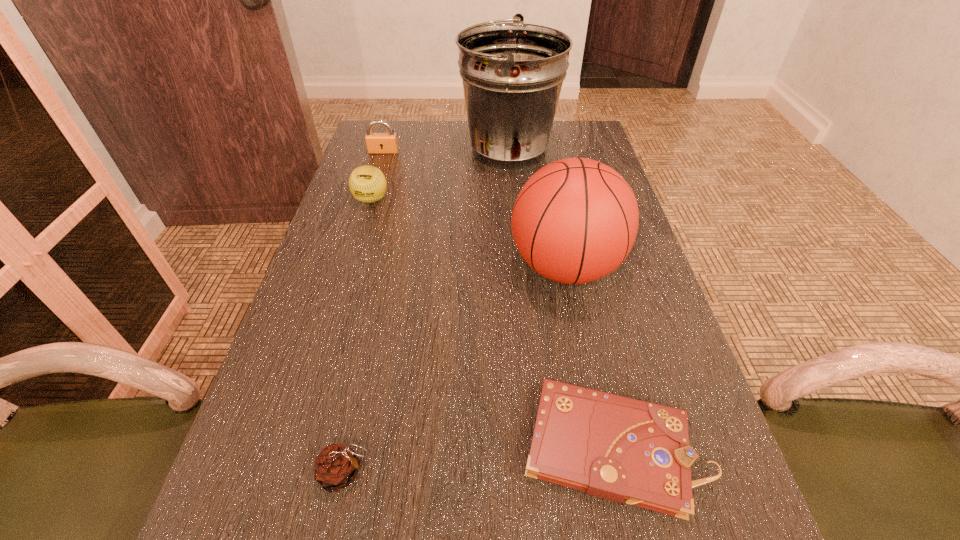
The height and width of the screenshot is (540, 960). Find the location of `free spot located 0.090m on the logo side of the fourth nearest object`. free spot located 0.090m on the logo side of the fourth nearest object is located at coordinates (361, 232).

In order to click on free space located with a leaf charm attached to the second shortest object in this screenshot , I will do `click(572, 473)`.

Image resolution: width=960 pixels, height=540 pixels. In order to click on free space located 0.240m on the left of the notebook in this screenshot , I will do `click(373, 447)`.

Image resolution: width=960 pixels, height=540 pixels. Find the location of `bucket present at the far edge`. bucket present at the far edge is located at coordinates (512, 73).

Find the location of a particular element. padlock located at the far edge is located at coordinates (377, 143).

Identify the location of padlock that is at the left edge. (377, 143).

At what (x,y) coordinates should I click in order to perform the action: click on softball present at the left edge. Please return your answer as a coordinate pair (x, y). Image resolution: width=960 pixels, height=540 pixels. Looking at the image, I should click on (367, 184).

You are a GUI agent. You are given a task and a screenshot of the screen. Output one action in this format:
    pyautogui.click(x=<x>, y=<y>)
    Task: Click on the pinecone present at the left edge
    
    Given the screenshot: What is the action you would take?
    pyautogui.click(x=336, y=467)

You are a GUI agent. You are given a task and a screenshot of the screen. Output one action in this format:
    pyautogui.click(x=<x>, y=<y>)
    Task: Click on the bucket present at the right edge
    The width and height of the screenshot is (960, 540).
    Given the screenshot: What is the action you would take?
    click(x=512, y=73)

The height and width of the screenshot is (540, 960). What are the coordinates of `basketball situated at the right edge` in the screenshot? It's located at (575, 220).